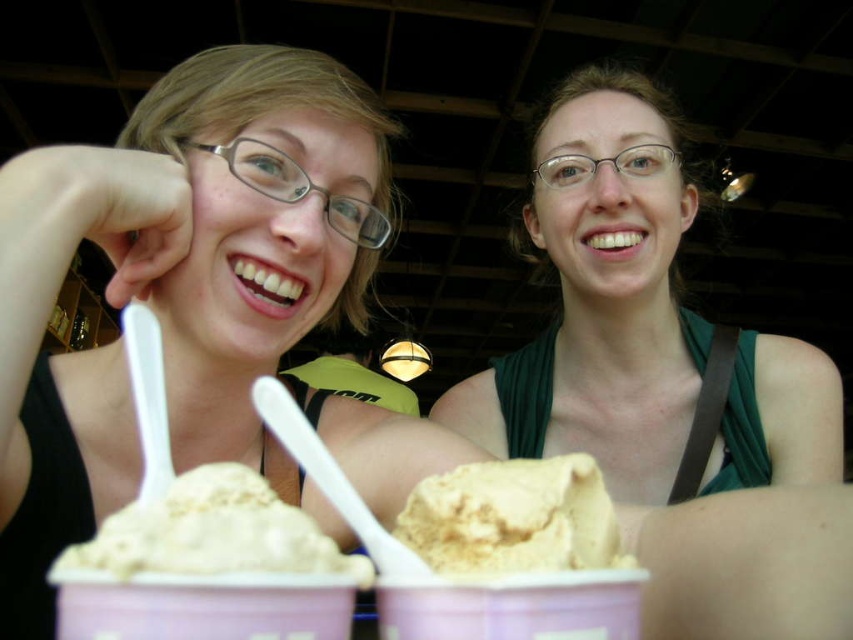
You are a chef trying to determine which item is shorter between the matte plastic spoon at upper center and the green matte tank top at center. Which one is shorter?

The matte plastic spoon at upper center is shorter than the green matte tank top at center.

You are a chef trying to retrieve the vanilla ice cream at center from the container. The matte plastic spoon at upper center is currently blocking your access. Can you lift the spoon to get to the ice cream?

The matte plastic spoon at upper center is positioned over vanilla ice cream at center, so lifting the spoon will allow access to the ice cream.

You are a photographer trying to capture a closeup of the matte plastic spoon at upper center without including the green matte tank top at center in the frame. Based on their positions, is this possible?

The matte plastic spoon at upper center is located below the green matte tank top at center, so it is possible to capture a closeup of the matte plastic spoon at upper center without including the green matte tank top at center by adjusting the camera angle to focus downward and exclude the tank top.